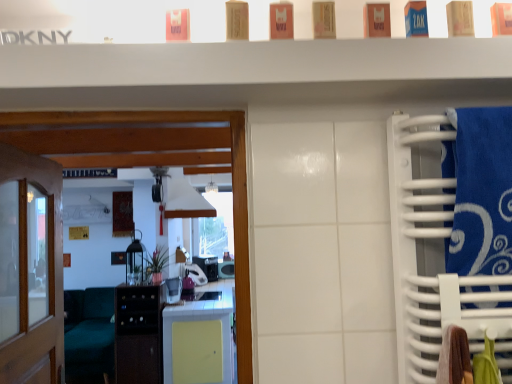
Looking at this image, measure the distance between point (131, 256) and camera.

Point (131, 256) is 4.64 meters away from camera.

Describe the element at coordinates (89, 332) in the screenshot. The width and height of the screenshot is (512, 384). I see `teal fabric couch at lower left` at that location.

Measure the distance between teal fabric couch at lower left and camera.

teal fabric couch at lower left and camera are 13.24 feet apart from each other.

What is the approximate width of purple plastic toaster at center, which ranks as the third appliance in front-to-back order?

The width of purple plastic toaster at center, which ranks as the third appliance in front-to-back order, is 14.38 inches.

The image size is (512, 384). Describe the element at coordinates (423, 244) in the screenshot. I see `blue fabric towel at right` at that location.

What do you see at coordinates (173, 289) in the screenshot? The width and height of the screenshot is (512, 384). I see `white glossy microwave at center, placed as the 5th appliance when sorted from back to front` at bounding box center [173, 289].

You are a GUI agent. You are given a task and a screenshot of the screen. Output one action in this format:
    pyautogui.click(x=<x>, y=<y>)
    Task: Click on the black plastic microwave at center, the 5th appliance in the front-to-back sequence
    The image size is (512, 384).
    Given the screenshot: What is the action you would take?
    pyautogui.click(x=226, y=269)

At what (x,y) coordinates should I click in order to perform the action: click on white matte exhaust hood at center. Please return your answer as a coordinate pair (x, y). Looking at the image, I should click on (186, 201).

I want to click on matte black lantern at center, the second appliance in the front-to-back sequence, so click(x=135, y=261).

Is teal fabric couch at lower left bigger than blue fabric towel at right?

Yes, teal fabric couch at lower left is bigger than blue fabric towel at right.

Does teal fabric couch at lower left turn towards blue fabric towel at right?

Yes, teal fabric couch at lower left is oriented towards blue fabric towel at right.

Does teal fabric couch at lower left have a greater height compared to blue fabric towel at right?

Indeed, teal fabric couch at lower left has a greater height compared to blue fabric towel at right.

Which of these two, teal fabric couch at lower left or blue fabric towel at right, is wider?

teal fabric couch at lower left is wider.

From the image's perspective, which object appears higher, white matte exhaust hood at center or white glossy microwave at center, placed as the 5th appliance when sorted from back to front?

white matte exhaust hood at center, from the image's perspective.

In the image, there is a white glossy microwave at center, placed as the 5th appliance when sorted from back to front. Where is `exhaust hood above it (from the image's perspective)`? exhaust hood above it (from the image's perspective) is located at coordinates (186, 201).

Between point (192, 211) and point (173, 289), which one is positioned behind?

The point (192, 211) is farther from the camera.

Is white matte exhaust hood at center smaller than white glossy microwave at center, the first appliance when ordered from front to back?

No, white matte exhaust hood at center is not smaller than white glossy microwave at center, the first appliance when ordered from front to back.

Considering the sizes of objects matte black lantern at center, the second appliance in the front-to-back sequence, and black plastic toaster at center, acting as the 2th appliance starting from the back, in the image provided, who is thinner, matte black lantern at center, the second appliance in the front-to-back sequence, or black plastic toaster at center, acting as the 2th appliance starting from the back,?

matte black lantern at center, the second appliance in the front-to-back sequence, is thinner.

From a real-world perspective, who is located higher, matte black lantern at center, the second appliance in the front-to-back sequence, or black plastic toaster at center, placed as the fourth appliance when sorted from front to back?

matte black lantern at center, the second appliance in the front-to-back sequence, from a real-world perspective.

Does matte black lantern at center, the second appliance in the front-to-back sequence, come in front of black plastic toaster at center, acting as the 2th appliance starting from the back?

Yes, the depth of matte black lantern at center, the second appliance in the front-to-back sequence, is less than that of black plastic toaster at center, acting as the 2th appliance starting from the back.

From the image's perspective, is teal fabric couch at lower left on top of transparent glass door at left?

No, from the image's perspective, teal fabric couch at lower left is not above transparent glass door at left.

From a real-world perspective, is teal fabric couch at lower left positioned above or below transparent glass door at left?

teal fabric couch at lower left is situated lower than transparent glass door at left in the real world.

Does point (76, 355) appear closer or farther from the camera than point (20, 336)?

Point (76, 355) is positioned farther from the camera compared to point (20, 336).

From the image's perspective, which appliance is the 2nd one above the teal fabric couch at lower left? Please provide its 2D coordinates.

[(196, 274)]

From the image's perspective, does purple plastic toaster at center, which ranks as the third appliance in front-to-back order, appear lower than teal fabric couch at lower left?

No, from the image's perspective, purple plastic toaster at center, which ranks as the third appliance in front-to-back order, is not below teal fabric couch at lower left.

Who is more distant, purple plastic toaster at center, which is the third appliance from back to front, or teal fabric couch at lower left?

purple plastic toaster at center, which is the third appliance from back to front.

Can you confirm if purple plastic toaster at center, which ranks as the third appliance in front-to-back order, is bigger than teal fabric couch at lower left?

No, purple plastic toaster at center, which ranks as the third appliance in front-to-back order, is not bigger than teal fabric couch at lower left.

Considering the relative sizes of black plastic microwave at center, which appears as the first appliance when viewed from the back, and white matte exhaust hood at center in the image provided, is black plastic microwave at center, which appears as the first appliance when viewed from the back, thinner than white matte exhaust hood at center?

Indeed, black plastic microwave at center, which appears as the first appliance when viewed from the back, has a lesser width compared to white matte exhaust hood at center.

In the scene shown: In terms of size, does black plastic microwave at center, the 5th appliance in the front-to-back sequence, appear bigger or smaller than white matte exhaust hood at center?

Considering their sizes, black plastic microwave at center, the 5th appliance in the front-to-back sequence, takes up less space than white matte exhaust hood at center.

Which is more to the left, black plastic microwave at center, the 5th appliance in the front-to-back sequence, or white matte exhaust hood at center?

From the viewer's perspective, white matte exhaust hood at center appears more on the left side.

From a real-world perspective, who is located higher, black plastic microwave at center, which appears as the first appliance when viewed from the back, or white matte exhaust hood at center?

white matte exhaust hood at center.

Where is `door above the black plastic toaster at center, acting as the 2th appliance starting from the back (from the image's perspective)`? Image resolution: width=512 pixels, height=384 pixels. door above the black plastic toaster at center, acting as the 2th appliance starting from the back (from the image's perspective) is located at coordinates (49, 277).

From a real-world perspective, is black plastic toaster at center, placed as the fourth appliance when sorted from front to back, physically located above or below transparent glass door at left?

black plastic toaster at center, placed as the fourth appliance when sorted from front to back, is situated lower than transparent glass door at left in the real world.

From the image's perspective, which one is positioned lower, black plastic toaster at center, acting as the 2th appliance starting from the back, or transparent glass door at left?

black plastic toaster at center, acting as the 2th appliance starting from the back.

Which is correct: black plastic toaster at center, placed as the fourth appliance when sorted from front to back, is inside transparent glass door at left, or outside of it?

black plastic toaster at center, placed as the fourth appliance when sorted from front to back, lies outside transparent glass door at left.

Locate an element on the screen. The height and width of the screenshot is (384, 512). furniture located underneath the blue fabric towel at right (from a real-world perspective) is located at coordinates (89, 332).

I want to click on the 2nd appliance positioned below the white matte exhaust hood at center (from the image's perspective), so click(173, 289).

When comparing their distances from transparent glass door at left, does black plastic microwave at center, the 5th appliance in the front-to-back sequence, or white matte exhaust hood at center seem closer?

white matte exhaust hood at center is positioned closer to the anchor transparent glass door at left.

Looking at the image, which one is located closer to transparent glass door at left, blue fabric towel at right or black plastic microwave at center, which appears as the first appliance when viewed from the back?

blue fabric towel at right lies closer to transparent glass door at left than the other object.

Looking at the image, which one is located closer to black plastic toaster at center, placed as the fourth appliance when sorted from front to back, black plastic microwave at center, which appears as the first appliance when viewed from the back, or white matte exhaust hood at center?

The object closer to black plastic toaster at center, placed as the fourth appliance when sorted from front to back, is black plastic microwave at center, which appears as the first appliance when viewed from the back.

Considering their positions, is white glossy microwave at center, the first appliance when ordered from front to back, positioned closer to black plastic toaster at center, placed as the fourth appliance when sorted from front to back, than black plastic microwave at center, the 5th appliance in the front-to-back sequence?

black plastic microwave at center, the 5th appliance in the front-to-back sequence, lies closer to black plastic toaster at center, placed as the fourth appliance when sorted from front to back, than the other object.

From the image, which object appears to be farther from transparent glass door at left, blue fabric towel at right or white glossy microwave at center, placed as the 5th appliance when sorted from back to front?

Based on the image, white glossy microwave at center, placed as the 5th appliance when sorted from back to front, appears to be further to transparent glass door at left.

Looking at the image, which one is located further to transparent glass door at left, purple plastic toaster at center, which ranks as the third appliance in front-to-back order, or white matte exhaust hood at center?

purple plastic toaster at center, which ranks as the third appliance in front-to-back order, is positioned further to the anchor transparent glass door at left.

Looking at the image, which one is located further to black plastic toaster at center, acting as the 2th appliance starting from the back, blue fabric towel at right or white matte exhaust hood at center?

The object further to black plastic toaster at center, acting as the 2th appliance starting from the back, is blue fabric towel at right.

Looking at the image, which one is located further to teal fabric couch at lower left, purple plastic toaster at center, which ranks as the third appliance in front-to-back order, or white glossy microwave at center, placed as the 5th appliance when sorted from back to front?

Based on the image, purple plastic toaster at center, which ranks as the third appliance in front-to-back order, appears to be further to teal fabric couch at lower left.

This screenshot has width=512, height=384. In order to click on exhaust hood located between transparent glass door at left and teal fabric couch at lower left in the depth direction in this screenshot , I will do `click(186, 201)`.

Locate an element on the screen. The width and height of the screenshot is (512, 384). exhaust hood between matte black lantern at center, which ranks as the fourth appliance in back-to-front order, and black plastic microwave at center, which appears as the first appliance when viewed from the back, along the z-axis is located at coordinates (186, 201).

You are a GUI agent. You are given a task and a screenshot of the screen. Output one action in this format:
    pyautogui.click(x=<x>, y=<y>)
    Task: Click on the exhaust hood positioned between transparent glass door at left and black plastic toaster at center, acting as the 2th appliance starting from the back, from near to far
    Image resolution: width=512 pixels, height=384 pixels.
    Given the screenshot: What is the action you would take?
    pyautogui.click(x=186, y=201)

At what (x,y) coordinates should I click in order to perform the action: click on exhaust hood located between transparent glass door at left and black plastic microwave at center, which appears as the first appliance when viewed from the back, in the depth direction. Please return your answer as a coordinate pair (x, y). Looking at the image, I should click on (186, 201).